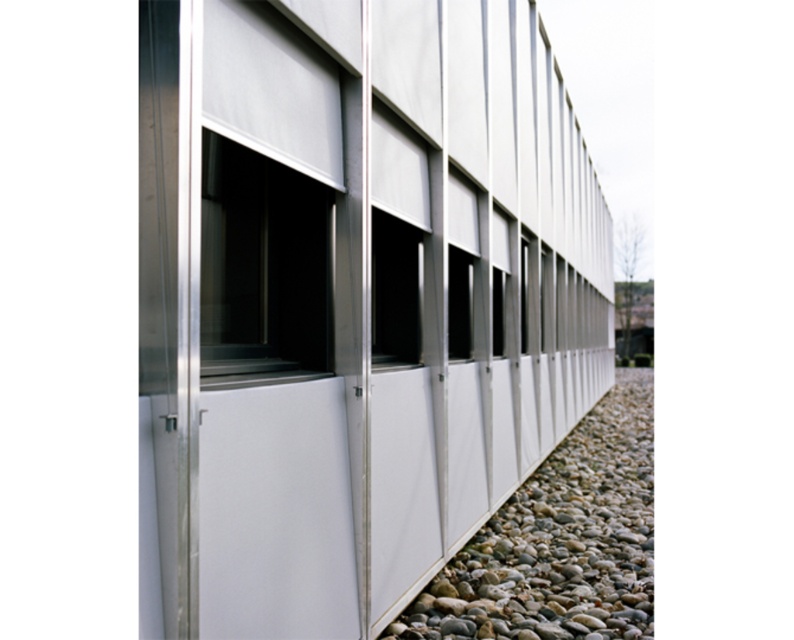
You are a maintenance worker needing to reach the transparent glass window at center from the smooth pebble at lower right. Given that your ladder is 3 meters long, will it be sufficient to bridge the gap?

The distance between the smooth pebble at lower right and the transparent glass window at center is 2.88 meters. Since the ladder is 3 meters long, it will be sufficient to bridge the gap as it is longer than the required distance.

Based on the photo, you are standing in front of the modern building and see the smooth pebble at lower right and the transparent glass window at center. Which object is closer to you?

The smooth pebble at lower right is closer to you because it is in front of the transparent glass window at center.